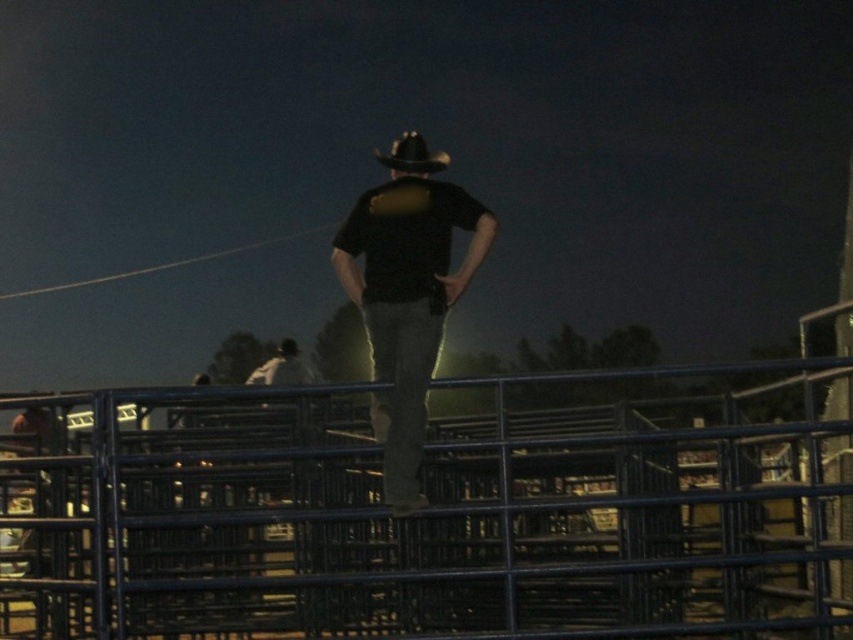
You are at the rodeo and want to take a photo of the blue metal fence at center and the black matte shirt at center from the front. Which object should you move towards to get both in the frame?

You should move towards the black matte shirt at center because the blue metal fence at center is to the left of it, so positioning yourself closer to the shirt will allow both objects to be captured in the frame.

You are at a rodeo event and want to take a photo of the blue metal fence at center and the black matte shirt at center. Which object is wider?

The blue metal fence at center is wider than the black matte shirt at center.

You are a photographer at the rodeo event and want to capture both the blue metal fence at center and the black matte cowboy hat at center in a single frame. Which object should you focus on first to ensure both are in the frame?

The blue metal fence at center has a larger size compared to the black matte cowboy hat at center, so you should focus on the blue metal fence at center first to ensure both objects are included in the frame.